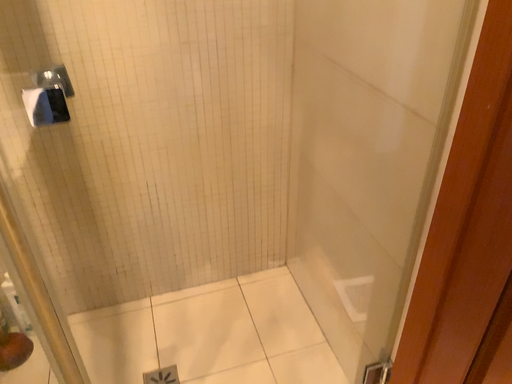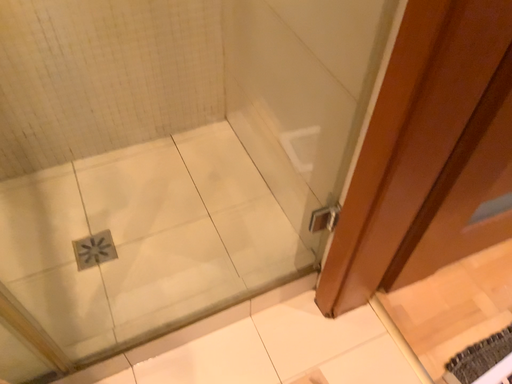
Question: Which way did the camera rotate in the video?

Choices:
 (A) rotated right
 (B) rotated left

Answer: (A)